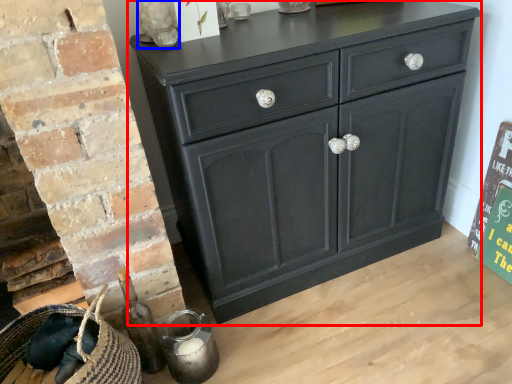
Question: Which object appears farthest to the camera in this image, chest of drawers (highlighted by a red box) or glass vase (highlighted by a blue box)?

Choices:
 (A) chest of drawers
 (B) glass vase

Answer: (B)